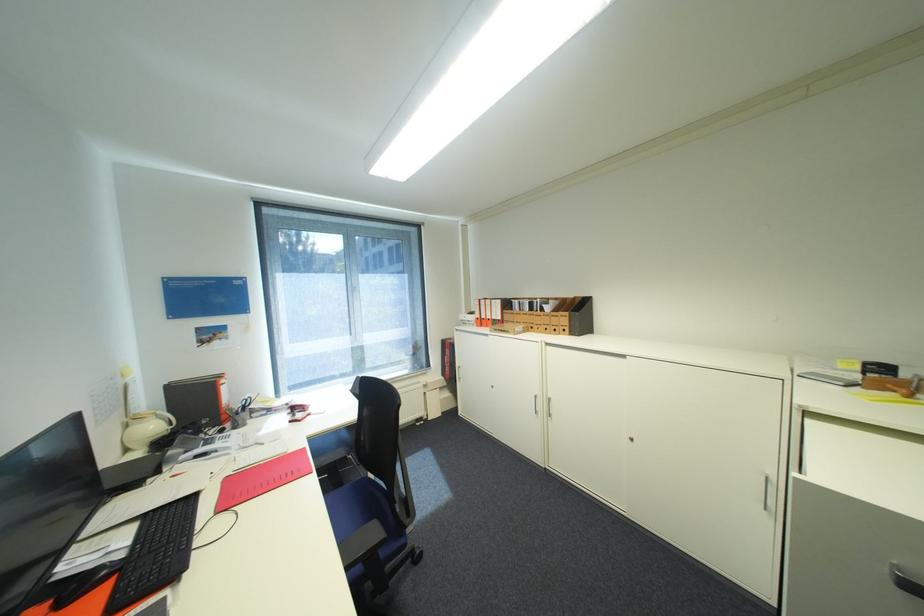
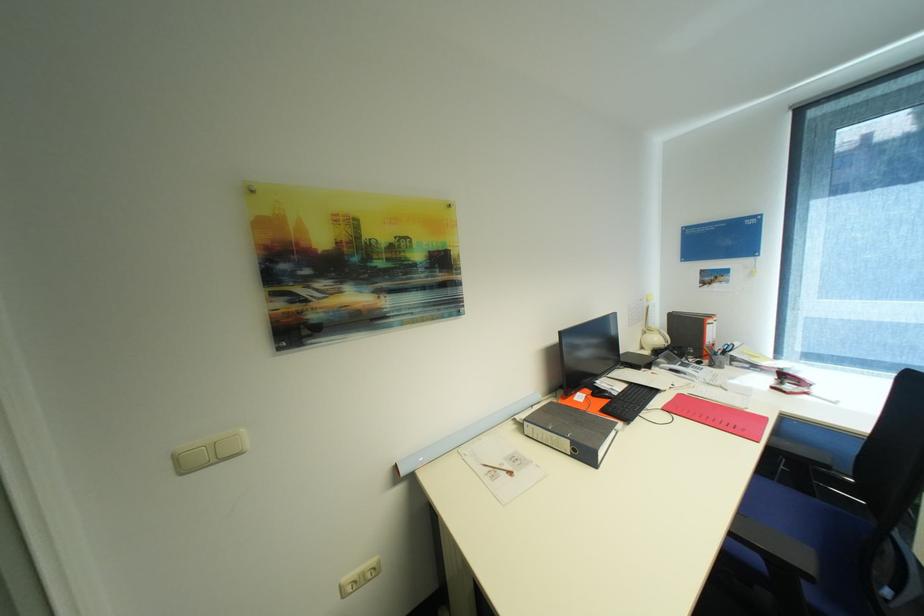
The point at (161, 427) is marked in the first image. Where is the corresponding point in the second image?

(663, 339)